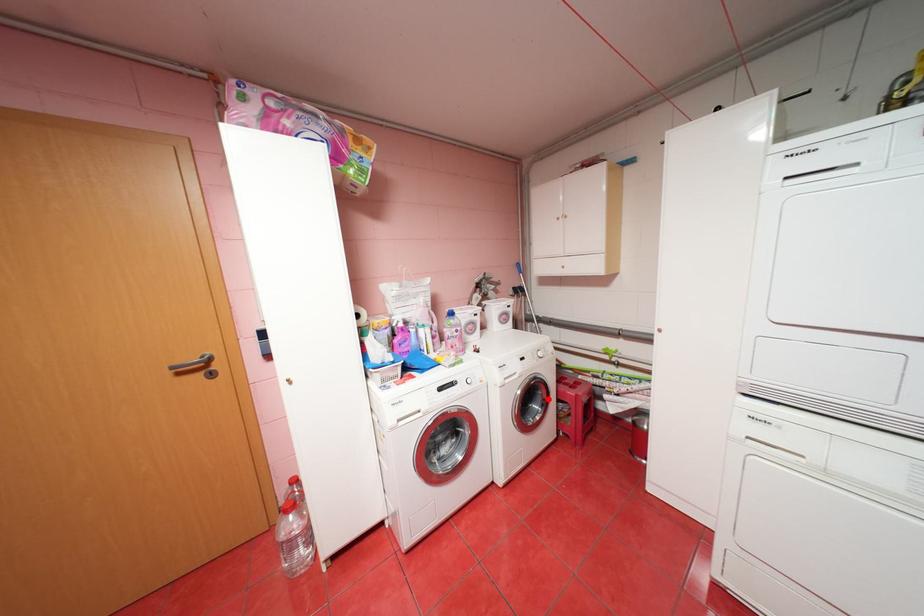
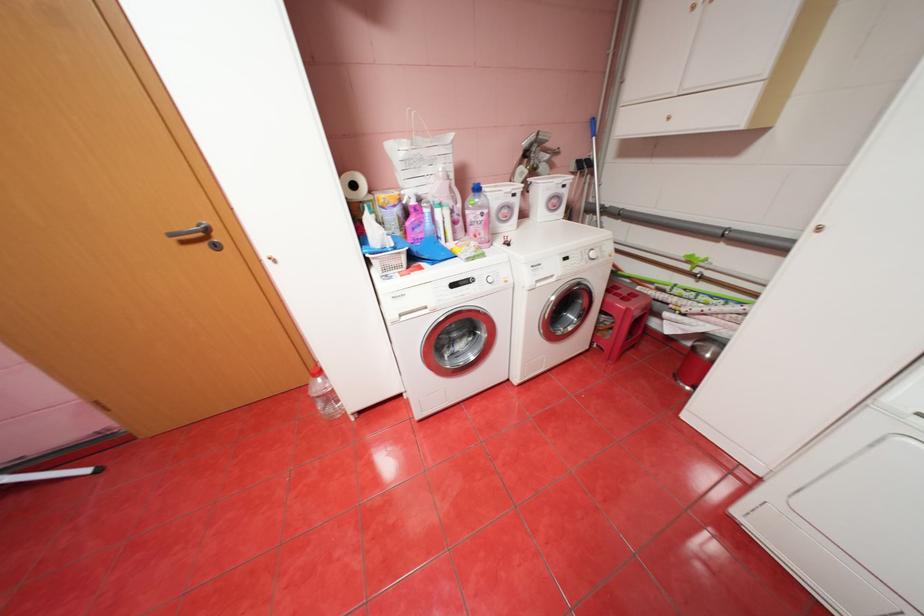
Locate, in the second image, the point that corresponds to the highlighted location in the first image.

(586, 309)